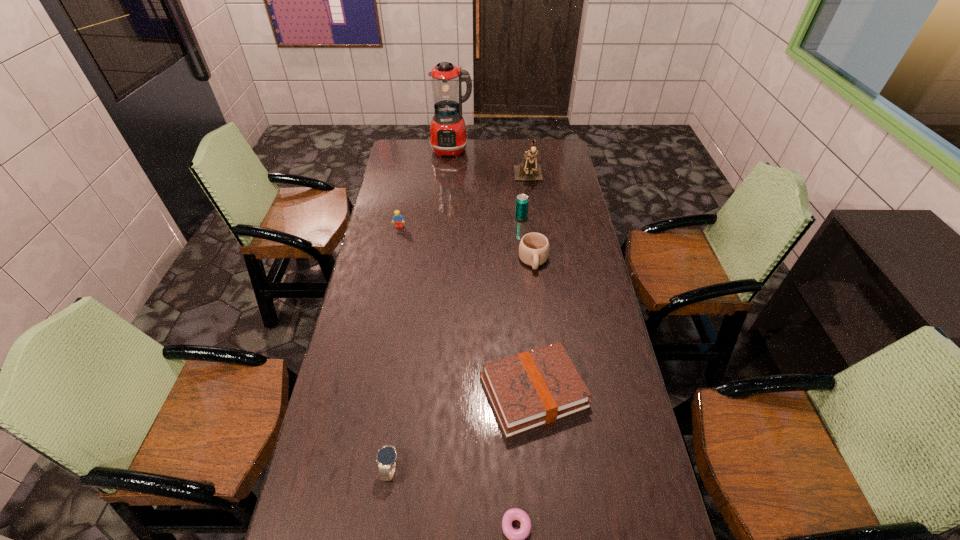
I want to click on empty location between the tallest object and the seventh farthest object, so pos(421,309).

Where is `vacant region between the seventh farthest object and the third tallest object`? The width and height of the screenshot is (960, 540). vacant region between the seventh farthest object and the third tallest object is located at coordinates (456, 343).

Identify which object is located as the seventh nearest to the leftmost object. Please provide its 2D coordinates. Your answer should be formatted as a tuple, i.e. [(x, y)], where the tuple contains the x and y coordinates of a point satisfying the conditions above.

[(516, 537)]

Point out which object is positioned as the fourth nearest to the sixth farthest object. Please provide its 2D coordinates. Your answer should be formatted as a tuple, i.e. [(x, y)], where the tuple contains the x and y coordinates of a point satisfying the conditions above.

[(521, 205)]

Locate an element on the screen. free region that satisfies the following two spatial constraints: 1. on the controls of the third farthest object; 2. on the right side of the food processor is located at coordinates (445, 218).

This screenshot has height=540, width=960. Find the location of `free region that satisfies the following two spatial constraints: 1. on the controls of the tallest object; 2. on the left side of the sixth shortest object`. free region that satisfies the following two spatial constraints: 1. on the controls of the tallest object; 2. on the left side of the sixth shortest object is located at coordinates (445, 218).